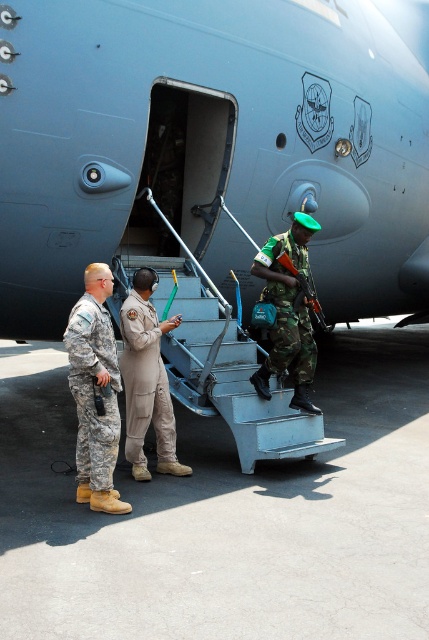
Question: Does light blue/stainless steel stairs at center lie behind camouflage fabric uniform at left?

Choices:
 (A) yes
 (B) no

Answer: (A)

Question: Which object is positioned farthest from the tan/textured fabric jumpsuit at center?

Choices:
 (A) camouflage fabric uniform at left
 (B) camouflage fabric uniform at center
 (C) light blue/stainless steel stairs at center
 (D) matte gray airplane at center

Answer: (D)

Question: From the image, what is the correct spatial relationship of tan/textured fabric jumpsuit at center in relation to camouflage fabric uniform at center?

Choices:
 (A) above
 (B) below

Answer: (B)

Question: Which point appears closest to the camera in this image?

Choices:
 (A) (368, 168)
 (B) (308, 268)
 (C) (84, 358)

Answer: (C)

Question: Considering the real-world distances, which object is closest to the camouflage fabric uniform at center?

Choices:
 (A) matte gray airplane at center
 (B) light blue/stainless steel stairs at center
 (C) camouflage fabric uniform at left

Answer: (B)

Question: Observing the image, what is the correct spatial positioning of light blue/stainless steel stairs at center in reference to camouflage fabric uniform at left?

Choices:
 (A) below
 (B) above

Answer: (B)